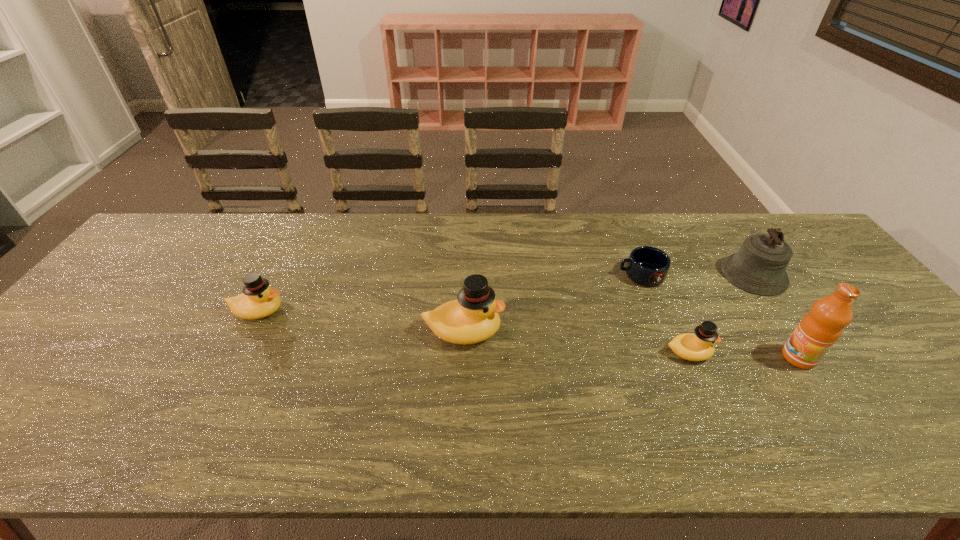
Identify the location of free space for a new duck on the right. (937, 376).